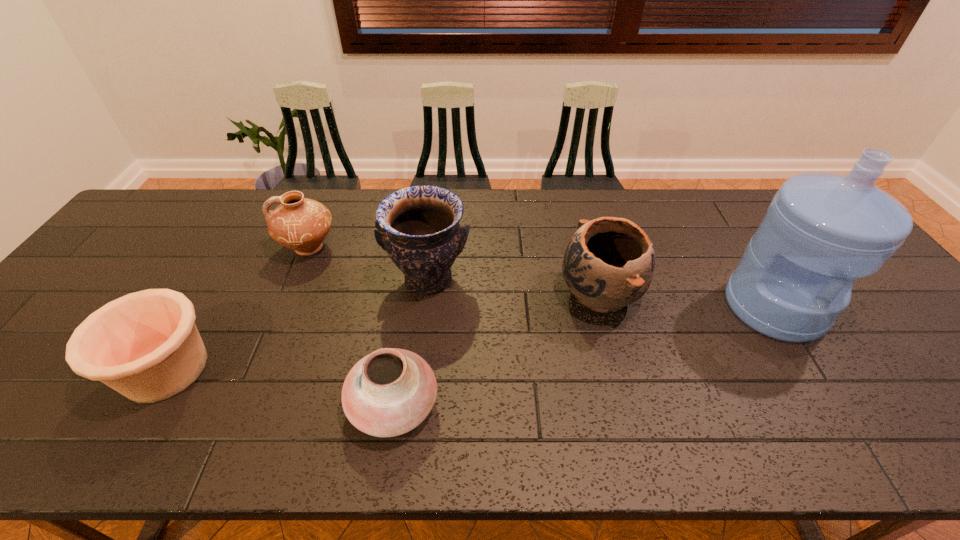
Locate an element on the screen. This screenshot has height=540, width=960. vacant space located on the back of the leftmost pottery is located at coordinates (225, 271).

Locate an element on the screen. The height and width of the screenshot is (540, 960). object present at the far edge is located at coordinates (302, 224).

Locate an element on the screen. This screenshot has height=540, width=960. vacant space at the far edge of the desktop is located at coordinates (338, 218).

Where is `vacant region at the near edge of the desktop`? vacant region at the near edge of the desktop is located at coordinates (417, 437).

You are a GUI agent. You are given a task and a screenshot of the screen. Output one action in this format:
    pyautogui.click(x=<x>, y=<y>)
    Task: Click on the vacant space at the left edge of the desktop
    Image resolution: width=960 pixels, height=540 pixels.
    Given the screenshot: What is the action you would take?
    pyautogui.click(x=85, y=275)

Find the location of a particular element. vacant space at the right edge of the desktop is located at coordinates (914, 340).

I want to click on free space between the fifth object from left to right and the rightmost object, so click(x=686, y=301).

At what (x,y) coordinates should I click in order to perform the action: click on unoccupied position between the tallest object and the rightmost pottery. Please return your answer as a coordinate pair (x, y). This screenshot has width=960, height=540. Looking at the image, I should click on (686, 301).

You are a GUI agent. You are given a task and a screenshot of the screen. Output one action in this format:
    pyautogui.click(x=<x>, y=<y>)
    Task: Click on the free space between the fifth object from left to right and the rightmost object
    The width and height of the screenshot is (960, 540).
    Given the screenshot: What is the action you would take?
    pyautogui.click(x=686, y=301)

Where is `free point between the second pottery from left to right and the water jug`? The width and height of the screenshot is (960, 540). free point between the second pottery from left to right and the water jug is located at coordinates (541, 277).